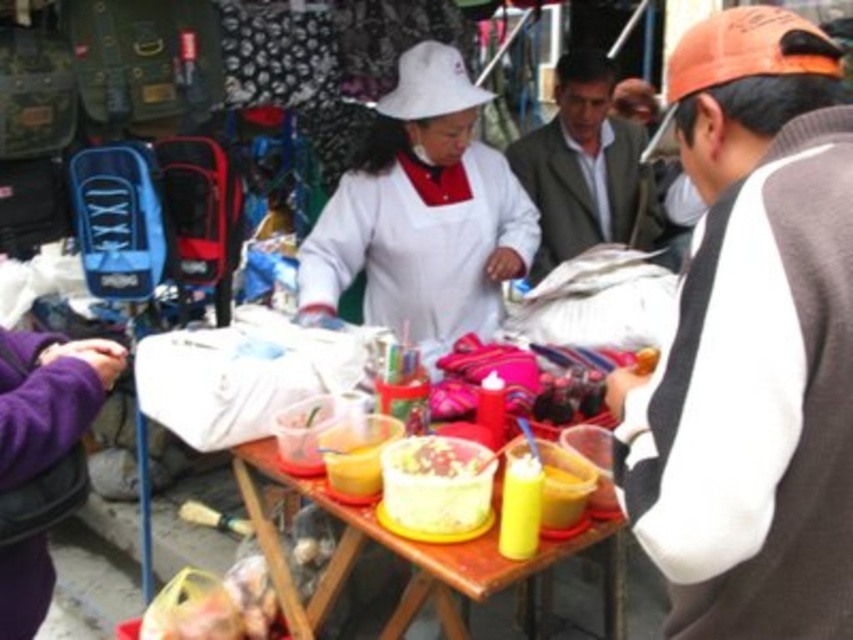
Does point (469, 218) come behind point (610, 529)?

Yes, it is.

Does white matte apron at center appear on the right side of wooden table at center?

Yes, white matte apron at center is to the right of wooden table at center.

Identify the location of white matte apron at center. The image size is (853, 640). (422, 214).

This screenshot has height=640, width=853. What do you see at coordinates (752, 346) in the screenshot?
I see `orange fabric street vendor at right` at bounding box center [752, 346].

Can you confirm if orange fabric street vendor at right is positioned above shiny plastic bowl at center?

Yes, orange fabric street vendor at right is above shiny plastic bowl at center.

What are the coordinates of `orange fabric street vendor at right` in the screenshot? It's located at tap(752, 346).

Is white matte apron at center closer to the viewer compared to shiny plastic bowl at center?

No, white matte apron at center is further to the viewer.

Between white matte apron at center and shiny plastic bowl at center, which one has more height?

Standing taller between the two is white matte apron at center.

Which is behind, point (445, 305) or point (445, 449)?

The point (445, 305) is behind.

Image resolution: width=853 pixels, height=640 pixels. I want to click on white matte apron at center, so click(x=422, y=214).